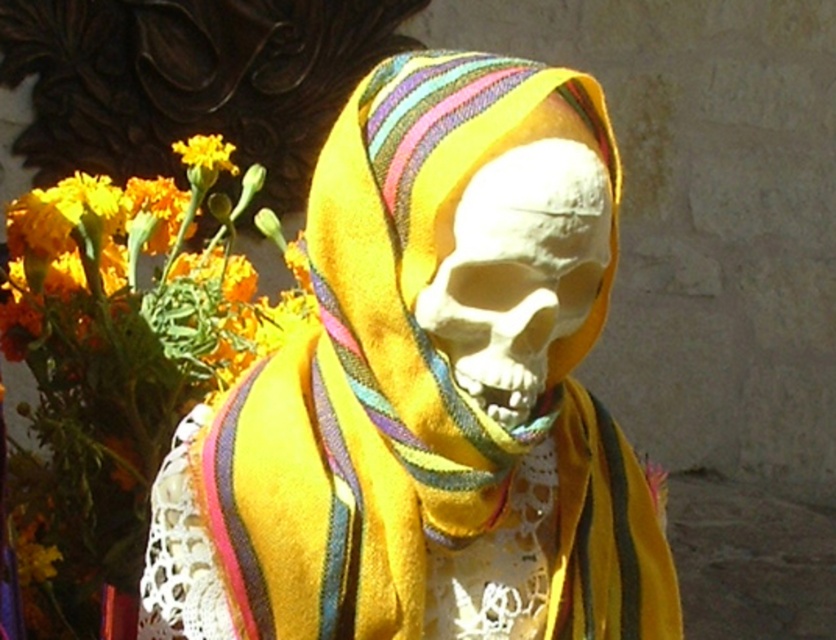
Image resolution: width=836 pixels, height=640 pixels. Find the location of `white matte skull at center`. white matte skull at center is located at coordinates (518, 269).

Is white matte skull at center below yellow fabric flower at upper left?

Indeed, white matte skull at center is positioned under yellow fabric flower at upper left.

Is point (538, 380) more distant than point (205, 140)?

No.

Identify the location of white matte skull at center. point(518,269).

Can you confirm if yellow fabric skull at center is bigger than yellow fabric flower at upper left?

Yes.

Is point (651, 554) closer to camera compared to point (181, 140)?

Yes, point (651, 554) is in front of point (181, 140).

Find the location of a particular element. This screenshot has height=640, width=836. yellow fabric skull at center is located at coordinates (427, 392).

Does yellow fabric skull at center have a larger size compared to white matte skull at center?

Correct, yellow fabric skull at center is larger in size than white matte skull at center.

Does point (599, 608) lie in front of point (563, 310)?

No, it is not.

I want to click on yellow fabric skull at center, so click(427, 392).